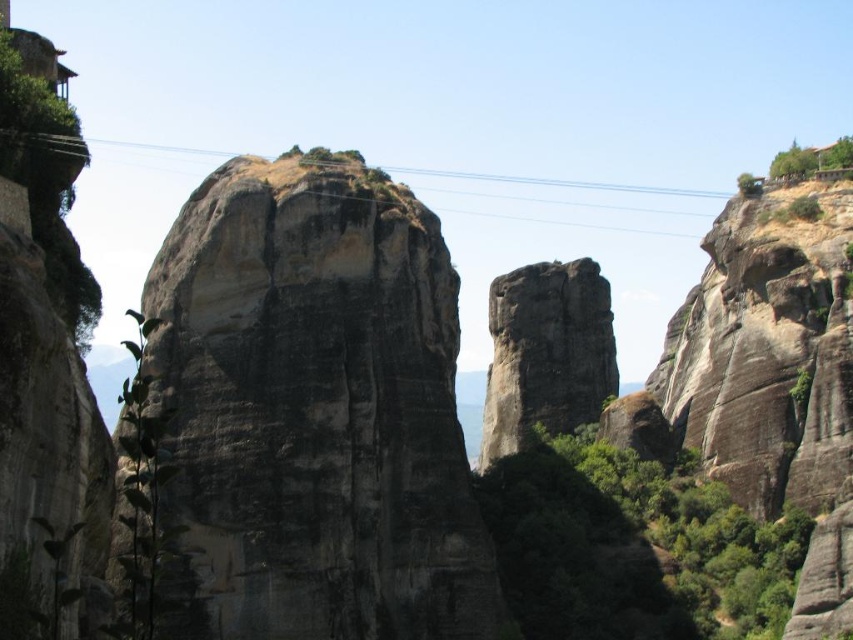
Question: Can you confirm if dark gray stone rock at center is positioned to the right of dark gray rock formation at center?

Choices:
 (A) no
 (B) yes

Answer: (A)

Question: Which point is closer to the camera taking this photo?

Choices:
 (A) (543, 275)
 (B) (265, 292)
 (C) (196, 152)

Answer: (B)

Question: Which object is positioned closest to the dark gray stone rock at center?

Choices:
 (A) black wire at center
 (B) dark gray rock formation at center

Answer: (A)

Question: Can you confirm if dark gray rock formation at center is thinner than black wire at center?

Choices:
 (A) yes
 (B) no

Answer: (A)

Question: Is dark gray rock formation at center above black wire at center?

Choices:
 (A) no
 (B) yes

Answer: (A)

Question: Among these points, which one is farthest from the camera?

Choices:
 (A) (508, 180)
 (B) (514, 365)

Answer: (A)